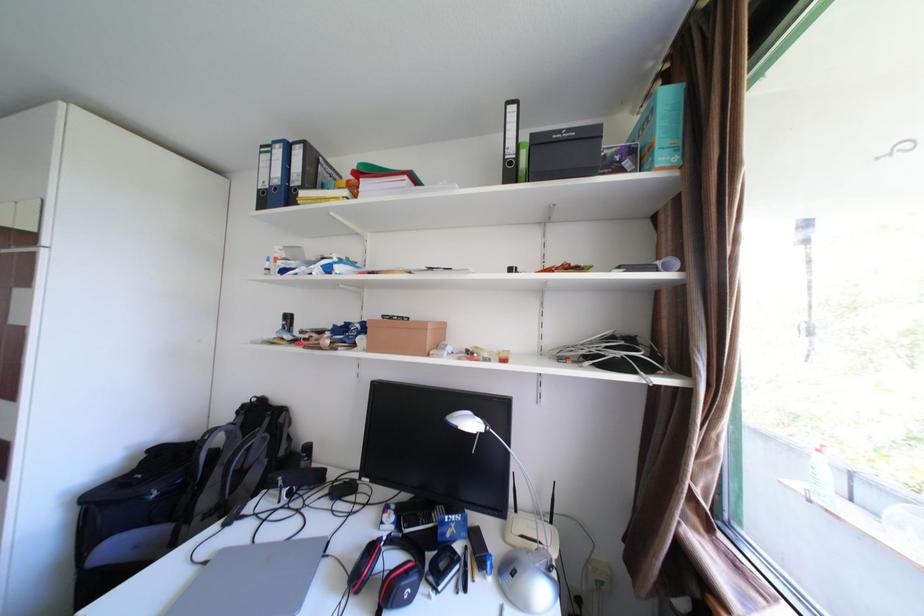
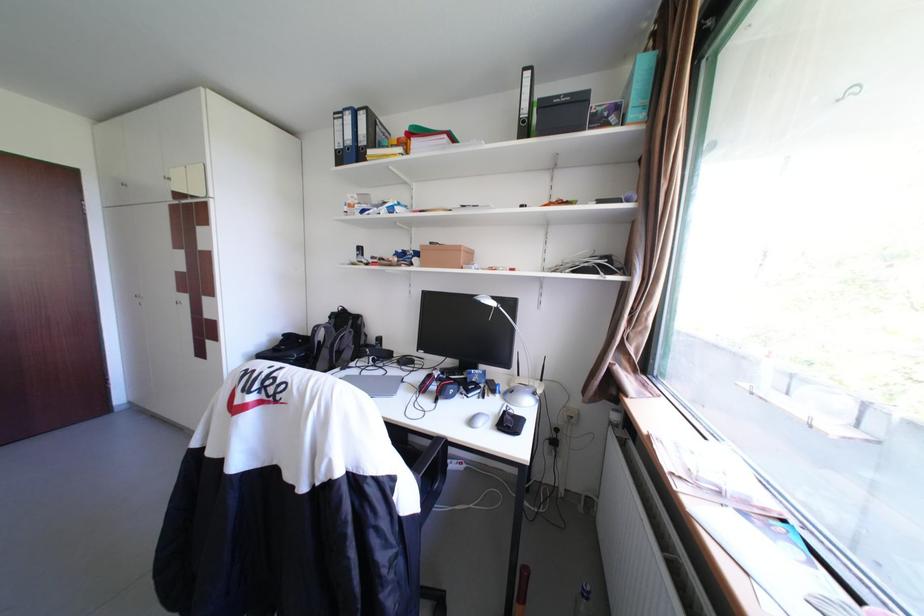
Find the pixel in the second image that matches point (275, 200) in the first image.

(351, 158)